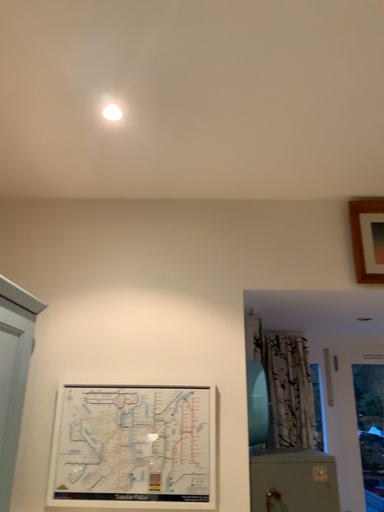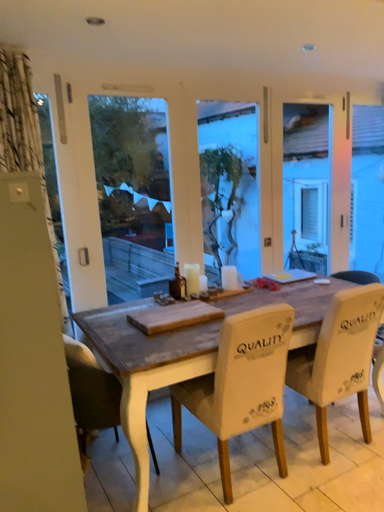
Question: How did the camera likely rotate when shooting the video?

Choices:
 (A) rotated left
 (B) rotated right

Answer: (B)